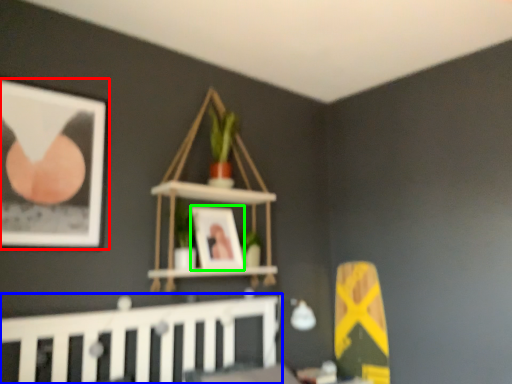
Question: Estimate the real-world distances between objects in this image. Which object is farther from picture frame (highlighted by a red box), rail (highlighted by a blue box) or picture frame (highlighted by a green box)?

Choices:
 (A) rail
 (B) picture frame

Answer: (B)